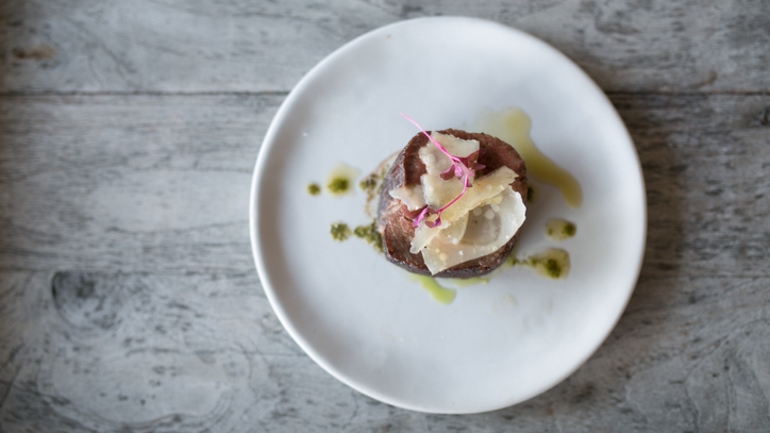
I want to click on plate, so click(x=410, y=348), click(x=414, y=80), click(x=568, y=322).